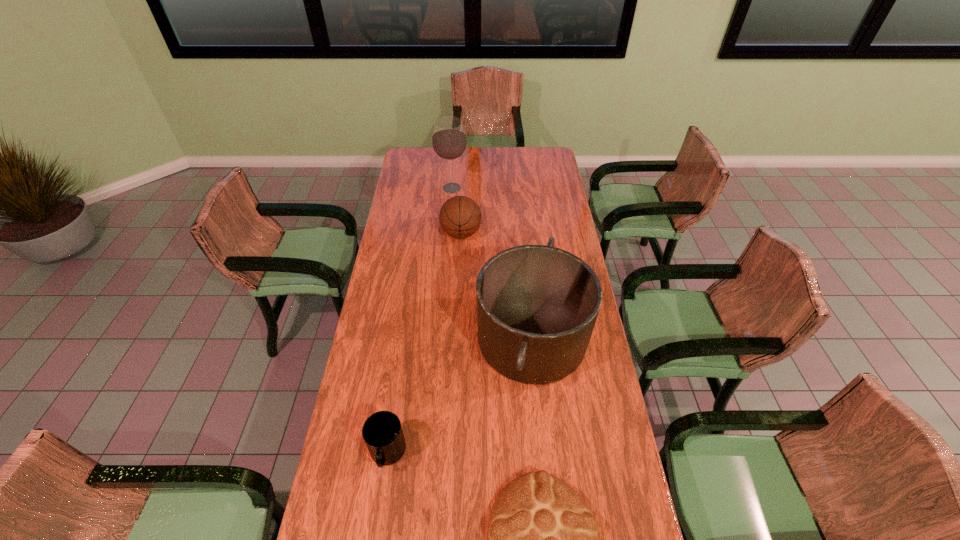
At what (x,y) coordinates should I click in order to perform the action: click on alcohol. Please return your answer as a coordinate pair (x, y). This screenshot has height=540, width=960. Looking at the image, I should click on (449, 141).

You are a GUI agent. You are given a task and a screenshot of the screen. Output one action in this format:
    pyautogui.click(x=<x>, y=<y>)
    Task: Click on the tallest object
    This screenshot has height=540, width=960.
    Given the screenshot: What is the action you would take?
    pyautogui.click(x=449, y=141)

Where is `the third farthest object`? the third farthest object is located at coordinates coord(537,305).

This screenshot has width=960, height=540. What are the coordinates of `the second tallest object` in the screenshot? It's located at (537, 305).

This screenshot has width=960, height=540. What are the coordinates of `the second farthest object` in the screenshot? It's located at (460, 217).

I want to click on the third tallest object, so click(460, 217).

What are the coordinates of `mug` in the screenshot? It's located at (382, 432).

You are a GUI agent. You are given a task and a screenshot of the screen. Output one action in this format:
    pyautogui.click(x=<x>, y=<y>)
    Task: Click on the vacant area situated on the front of the tallest object
    Image resolution: width=960 pixels, height=540 pixels.
    Given the screenshot: What is the action you would take?
    pyautogui.click(x=450, y=217)

Locate an element on the screen. The width and height of the screenshot is (960, 540). vacant space positioned 0.250m on the back of the pan is located at coordinates (522, 243).

The height and width of the screenshot is (540, 960). Identify the location of blank area located on the side with brand label of the third shortest object. (562, 233).